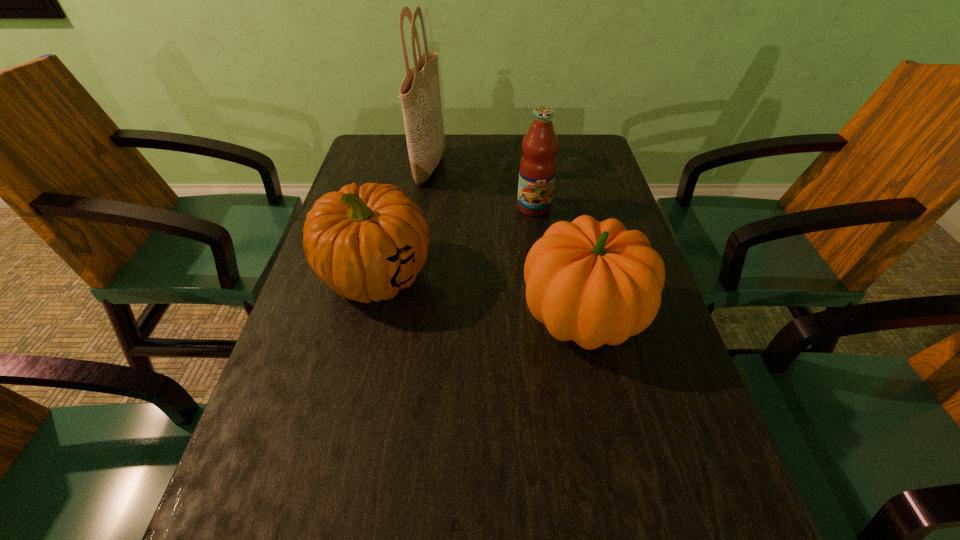
Locate an element on the screen. The width and height of the screenshot is (960, 540). object at the left edge is located at coordinates (367, 243).

Where is `object that is at the right edge`? The height and width of the screenshot is (540, 960). object that is at the right edge is located at coordinates (596, 283).

In the image, there is a desktop. At what (x,y) coordinates should I click in order to perform the action: click on vacant space at the far edge. Please return your answer as a coordinate pair (x, y). The height and width of the screenshot is (540, 960). Looking at the image, I should click on (498, 174).

The image size is (960, 540). In the image, there is a desktop. Find the location of `free region at the left edge`. free region at the left edge is located at coordinates (325, 284).

The image size is (960, 540). I want to click on blank space at the right edge of the desktop, so click(695, 447).

This screenshot has width=960, height=540. Identify the location of free space at the far right corner of the desktop. (564, 148).

Locate an element on the screen. free space between the farthest object and the right pumpkin is located at coordinates (507, 242).

Locate an element on the screen. empty space between the tallest object and the fruit juice is located at coordinates (482, 187).

Locate an element on the screen. The height and width of the screenshot is (540, 960). free space between the right pumpkin and the shopping bag is located at coordinates (507, 242).

The width and height of the screenshot is (960, 540). I want to click on empty space that is in between the second farthest object and the tallest object, so click(x=482, y=187).